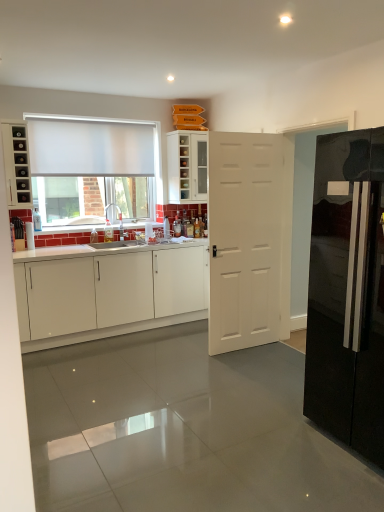
How much space does white glossy cabinet at upper center, which ranks as the 1th cabinetry in top-to-bottom order, occupy vertically?

white glossy cabinet at upper center, which ranks as the 1th cabinetry in top-to-bottom order, is 31.68 inches in height.

The width and height of the screenshot is (384, 512). Identify the location of white glossy cabinet at upper center, which ranks as the 1th cabinetry in top-to-bottom order. (187, 167).

Locate an element on the screen. Image resolution: width=384 pixels, height=512 pixels. white matte door at center is located at coordinates (245, 239).

Which is more to the right, white matte door at center or white matte curtain at upper left?

From the viewer's perspective, white matte door at center appears more on the right side.

Is white matte door at center surrounding white matte curtain at upper left?

Definitely not — white matte curtain at upper left is not inside white matte door at center.

Is white matte curtain at upper left at the back of white matte door at center?

No, white matte curtain at upper left is not at the back of white matte door at center.

Can you confirm if white matte door at center is bigger than white matte curtain at upper left?

Correct, white matte door at center is larger in size than white matte curtain at upper left.

Is white glossy cabinet at upper center, which is counted as the third cabinetry, starting from the bottom, directly adjacent to white glossy cabinets at left, the third cabinetry from the top?

No, white glossy cabinet at upper center, which is counted as the third cabinetry, starting from the bottom, is not touching white glossy cabinets at left, the third cabinetry from the top.

Considering the relative sizes of white glossy cabinet at upper center, which ranks as the 1th cabinetry in top-to-bottom order, and white glossy cabinets at left, the third cabinetry from the top, in the image provided, is white glossy cabinet at upper center, which ranks as the 1th cabinetry in top-to-bottom order, thinner than white glossy cabinets at left, the third cabinetry from the top,?

Yes, white glossy cabinet at upper center, which ranks as the 1th cabinetry in top-to-bottom order, is thinner than white glossy cabinets at left, the third cabinetry from the top.

Is point (180, 173) closer to camera compared to point (196, 286)?

That is False.

From the image's perspective, which one is positioned lower, white glossy cabinet at upper center, which ranks as the 1th cabinetry in top-to-bottom order, or glossy black refrigerator at right?

From the image's view, glossy black refrigerator at right is below.

Choose the correct answer: Is white glossy cabinet at upper center, which is counted as the third cabinetry, starting from the bottom, inside glossy black refrigerator at right or outside it?

white glossy cabinet at upper center, which is counted as the third cabinetry, starting from the bottom, exists outside the volume of glossy black refrigerator at right.

Considering the sizes of objects white glossy cabinet at upper center, which is counted as the third cabinetry, starting from the bottom, and glossy black refrigerator at right in the image provided, who is bigger, white glossy cabinet at upper center, which is counted as the third cabinetry, starting from the bottom, or glossy black refrigerator at right?

Bigger between the two is glossy black refrigerator at right.

Is there a large distance between white glossy cabinet at upper center, which is counted as the third cabinetry, starting from the bottom, and glossy black refrigerator at right?

That's right, there is a large distance between white glossy cabinet at upper center, which is counted as the third cabinetry, starting from the bottom, and glossy black refrigerator at right.

From the image's perspective, is white glossy cabinet at upper center, which is counted as the third cabinetry, starting from the bottom, above frosted glass window at upper left?

Yes.

Is white glossy cabinet at upper center, which ranks as the 1th cabinetry in top-to-bottom order, oriented towards frosted glass window at upper left?

No, white glossy cabinet at upper center, which ranks as the 1th cabinetry in top-to-bottom order, does not turn towards frosted glass window at upper left.

Which of these two, white glossy cabinet at upper center, which ranks as the 1th cabinetry in top-to-bottom order, or frosted glass window at upper left, stands shorter?

With less height is white glossy cabinet at upper center, which ranks as the 1th cabinetry in top-to-bottom order.

Is white matte curtain at upper left inside or outside of white glossy cabinets at left, arranged as the first cabinetry when ordered from the bottom?

The correct answer is: outside.

Is white glossy cabinets at left, arranged as the first cabinetry when ordered from the bottom, at the back of white matte curtain at upper left?

white matte curtain at upper left is not turned away from white glossy cabinets at left, arranged as the first cabinetry when ordered from the bottom.

Considering the sizes of objects white matte curtain at upper left and white glossy cabinets at left, the third cabinetry from the top, in the image provided, who is smaller, white matte curtain at upper left or white glossy cabinets at left, the third cabinetry from the top,?

white matte curtain at upper left.

Locate an element on the screen. This screenshot has width=384, height=512. refrigerator lying on the right of white glossy cabinets at left, the third cabinetry from the top is located at coordinates (347, 292).

Which of these two, glossy black refrigerator at right or white glossy cabinets at left, arranged as the first cabinetry when ordered from the bottom, stands taller?

With more height is glossy black refrigerator at right.

Considering the sizes of objects glossy black refrigerator at right and white glossy cabinets at left, arranged as the first cabinetry when ordered from the bottom, in the image provided, who is bigger, glossy black refrigerator at right or white glossy cabinets at left, arranged as the first cabinetry when ordered from the bottom,?

Bigger between the two is white glossy cabinets at left, arranged as the first cabinetry when ordered from the bottom.

Which of these two, glossy black refrigerator at right or white glossy cabinets at left, the third cabinetry from the top, is wider?

With larger width is glossy black refrigerator at right.

Is the depth of white glossy cabinets at left, arranged as the first cabinetry when ordered from the bottom, less than that of glossy black refrigerator at right?

No, white glossy cabinets at left, arranged as the first cabinetry when ordered from the bottom, is behind glossy black refrigerator at right.

Is white glossy cabinets at left, the third cabinetry from the top, turned away from glossy black refrigerator at right?

No, glossy black refrigerator at right is not at the back of white glossy cabinets at left, the third cabinetry from the top.

Can you confirm if white glossy cabinets at left, arranged as the first cabinetry when ordered from the bottom, is taller than glossy black refrigerator at right?

No.

From the image's perspective, which one is positioned lower, white glossy cabinets at left, the third cabinetry from the top, or glossy black refrigerator at right?

white glossy cabinets at left, the third cabinetry from the top, from the image's perspective.

This screenshot has height=512, width=384. In order to click on curtain lying above the white matte door at center (from the image's perspective) in this screenshot , I will do `click(92, 147)`.

Which cabinetry is the 1st one when counting from the left side of the white glossy cabinet at upper center, which is counted as the third cabinetry, starting from the bottom? Please provide its 2D coordinates.

[(112, 294)]

When comparing their distances from white glossy cabinets at left, the third cabinetry from the top, does frosted glass window at upper left or glossy black refrigerator at right seem further?

The object further to white glossy cabinets at left, the third cabinetry from the top, is glossy black refrigerator at right.

Estimate the real-world distances between objects in this image. Which object is closer to frosted glass window at upper left, glossy black refrigerator at right or white glossy cabinet at upper center, which ranks as the 1th cabinetry in top-to-bottom order?

The object closer to frosted glass window at upper left is white glossy cabinet at upper center, which ranks as the 1th cabinetry in top-to-bottom order.

Based on their spatial positions, is white glossy cabinet at upper center, which is counted as the third cabinetry, starting from the bottom, or white matte door at center further from white matte curtain at upper left?

white matte door at center.

Considering their positions, is white glossy cabinet at upper center, which is counted as the third cabinetry, starting from the bottom, positioned closer to matte black cabinet at left, which ranks as the second cabinetry in bottom-to-top order, than white matte curtain at upper left?

white matte curtain at upper left is closer to matte black cabinet at left, which ranks as the second cabinetry in bottom-to-top order.

Based on their spatial positions, is white matte curtain at upper left or frosted glass window at upper left further from matte black cabinet at left, the second cabinetry from the top?

Based on the image, frosted glass window at upper left appears to be further to matte black cabinet at left, the second cabinetry from the top.

Consider the image. From the image, which object appears to be nearer to white glossy cabinets at left, the third cabinetry from the top, white glossy cabinet at upper center, which is counted as the third cabinetry, starting from the bottom, or white matte door at center?

white matte door at center is positioned closer to the anchor white glossy cabinets at left, the third cabinetry from the top.

Looking at this image, based on their spatial positions, is white matte door at center or white glossy cabinet at upper center, which ranks as the 1th cabinetry in top-to-bottom order, closer to matte black cabinet at left, which ranks as the second cabinetry in bottom-to-top order?

white glossy cabinet at upper center, which ranks as the 1th cabinetry in top-to-bottom order.

Consider the image. Considering their positions, is white glossy cabinets at left, arranged as the first cabinetry when ordered from the bottom, positioned closer to matte black cabinet at left, the second cabinetry from the top, than white matte curtain at upper left?

white matte curtain at upper left.

Image resolution: width=384 pixels, height=512 pixels. Identify the location of door between glossy black refrigerator at right and white glossy cabinets at left, arranged as the first cabinetry when ordered from the bottom, along the z-axis. (245, 239).

Locate an element on the screen. The width and height of the screenshot is (384, 512). cabinetry between frosted glass window at upper left and white glossy cabinets at left, the third cabinetry from the top, in the up-down direction is located at coordinates (17, 165).

Where is `door between matte black cabinet at left, the second cabinetry from the top, and glossy black refrigerator at right from left to right`? The height and width of the screenshot is (512, 384). door between matte black cabinet at left, the second cabinetry from the top, and glossy black refrigerator at right from left to right is located at coordinates (245, 239).

Identify the location of curtain between matte black cabinet at left, which ranks as the second cabinetry in bottom-to-top order, and glossy black refrigerator at right, in the horizontal direction. This screenshot has height=512, width=384. (x=92, y=147).